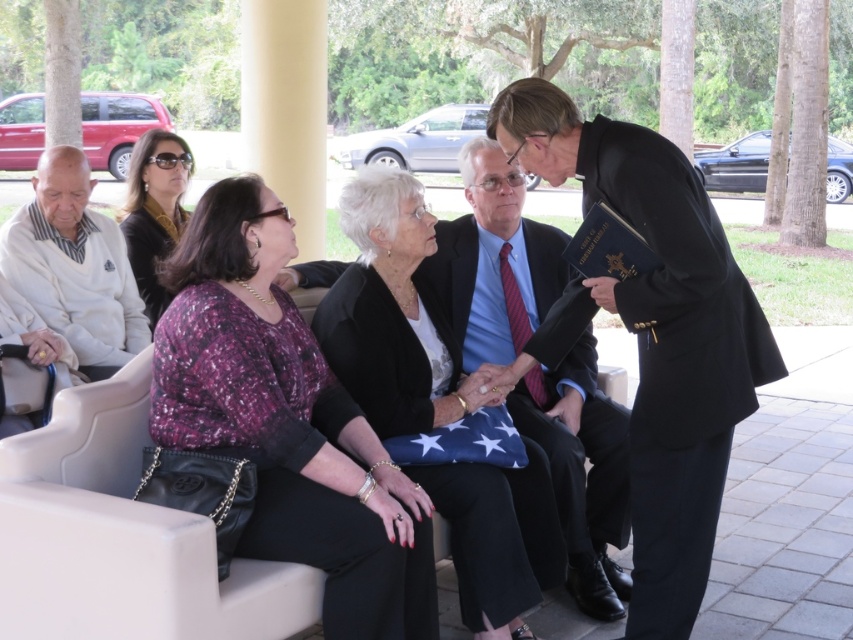
Does black suit at right appear on the left side of black satin blazer at center?

No, black suit at right is not to the left of black satin blazer at center.

Between black suit at right and black satin blazer at center, which one appears on the right side from the viewer's perspective?

black suit at right is more to the right.

The height and width of the screenshot is (640, 853). In order to click on black suit at right in this screenshot , I will do `click(653, 336)`.

At what (x,y) coordinates should I click in order to perform the action: click on black suit at right. Please return your answer as a coordinate pair (x, y). This screenshot has height=640, width=853. Looking at the image, I should click on (653, 336).

Can you confirm if matte purple blouse at center is taller than white sweater at left?

Indeed, matte purple blouse at center has a greater height compared to white sweater at left.

Can you confirm if matte purple blouse at center is positioned to the left of white sweater at left?

No, matte purple blouse at center is not to the left of white sweater at left.

What do you see at coordinates (286, 420) in the screenshot? The width and height of the screenshot is (853, 640). I see `matte purple blouse at center` at bounding box center [286, 420].

Locate an element on the screen. The height and width of the screenshot is (640, 853). matte purple blouse at center is located at coordinates (286, 420).

Is black suit at right to the left of white sweater at left from the viewer's perspective?

In fact, black suit at right is to the right of white sweater at left.

Can you confirm if black suit at right is shorter than white sweater at left?

No.

Between point (637, 440) and point (91, 256), which one is positioned in front?

Point (637, 440) is in front.

The image size is (853, 640). Identify the location of black suit at right. (653, 336).